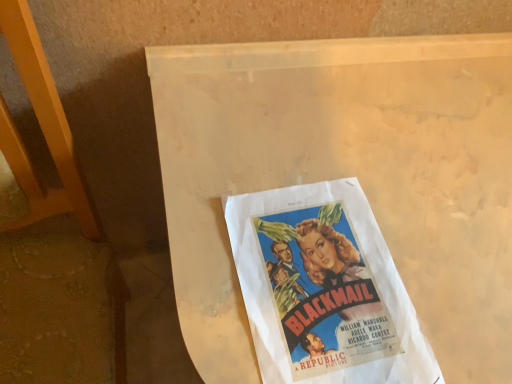
Find the location of a particular element. free region on the left part of vintage paper poster at center is located at coordinates coord(202,228).